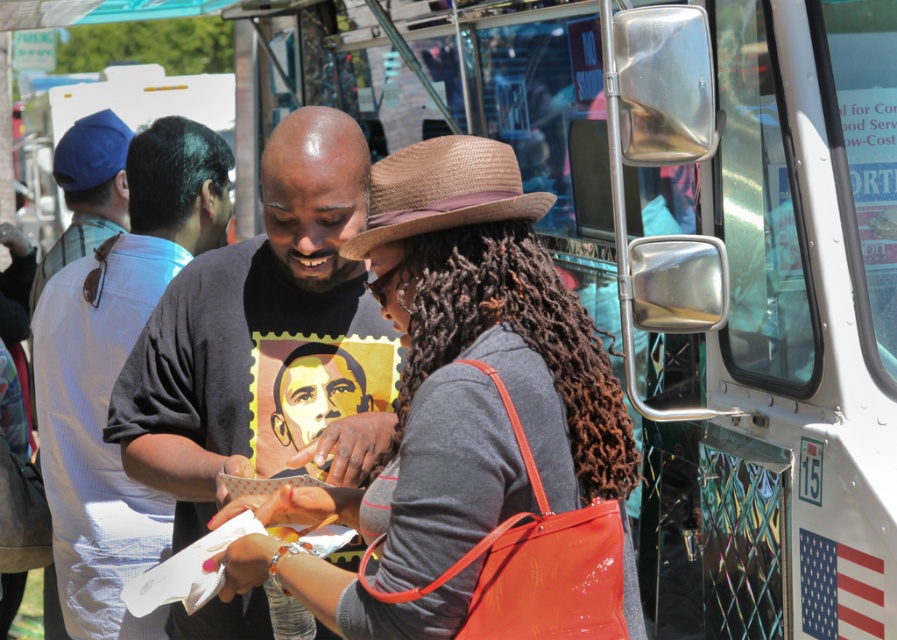
You are trying to decide which object is wider between the matte gray shirt at center and the brown curly hair at center. Based on the scene description, which one is wider?

→ The matte gray shirt at center is wider than the brown curly hair at center according to the description.